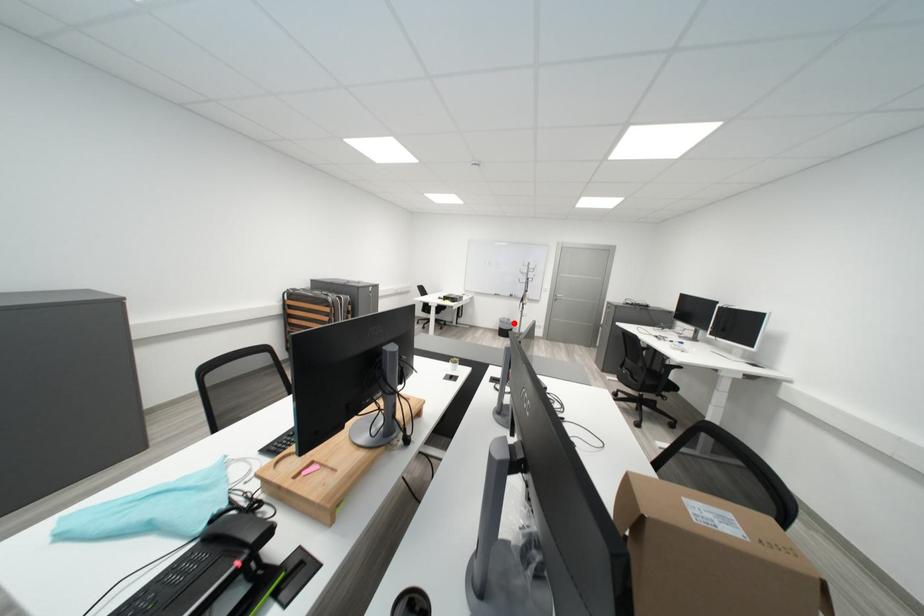
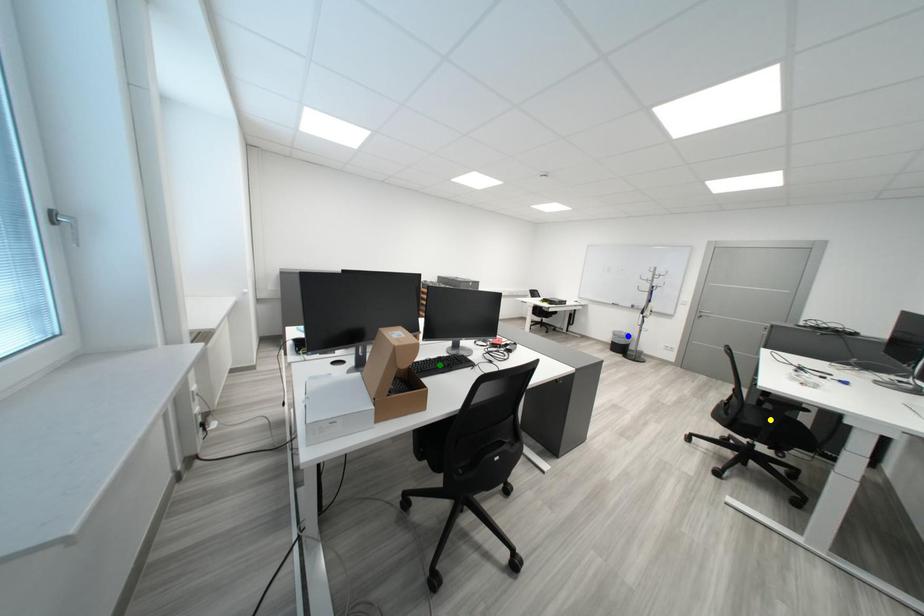
Question: I am providing you with two images of the same scene from different viewpoints. A red point is marked on the first image. You are given multiple points on the second image. Can you choose the point in image 2 that corresponds to the point in image 1?

Choices:
 (A) green point
 (B) yellow point
 (C) blue point

Answer: (C)